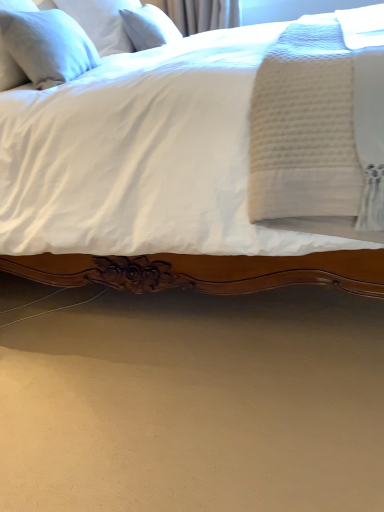
Question: Can you confirm if white linen pillow at upper left, placed as the first pillow when sorted from front to back, is positioned to the left of white soft pillow at upper left, which is the 2th pillow from back to front?

Choices:
 (A) yes
 (B) no

Answer: (A)

Question: Is white linen pillow at upper left, the third pillow viewed from the back, positioned with its back to white soft pillow at upper left, which is the 2th pillow from back to front?

Choices:
 (A) yes
 (B) no

Answer: (B)

Question: Could you tell me if white linen pillow at upper left, placed as the first pillow when sorted from front to back, is turned towards white soft pillow at upper left, marked as the second pillow in a front-to-back arrangement?

Choices:
 (A) yes
 (B) no

Answer: (B)

Question: Does white linen pillow at upper left, placed as the first pillow when sorted from front to back, have a greater width compared to white soft pillow at upper left, which is the 2th pillow from back to front?

Choices:
 (A) no
 (B) yes

Answer: (A)

Question: Is white linen pillow at upper left, placed as the first pillow when sorted from front to back, outside white soft pillow at upper left, marked as the second pillow in a front-to-back arrangement?

Choices:
 (A) yes
 (B) no

Answer: (A)

Question: Does white linen pillow at upper left, placed as the first pillow when sorted from front to back, have a lesser width compared to white soft pillow at upper left, marked as the second pillow in a front-to-back arrangement?

Choices:
 (A) no
 (B) yes

Answer: (B)

Question: Can you confirm if white soft pillow at upper left, marked as the second pillow in a front-to-back arrangement, is smaller than white soft pillow at upper left, which is counted as the third pillow, starting from the front?

Choices:
 (A) no
 (B) yes

Answer: (A)

Question: Is white soft pillow at upper left, which is the 2th pillow from back to front, bigger than white soft pillow at upper left, the 1th pillow when ordered from back to front?

Choices:
 (A) yes
 (B) no

Answer: (A)

Question: Is white soft pillow at upper left, which is the 2th pillow from back to front, at the right side of white soft pillow at upper left, which is counted as the third pillow, starting from the front?

Choices:
 (A) yes
 (B) no

Answer: (B)

Question: Is white soft pillow at upper left, marked as the second pillow in a front-to-back arrangement, positioned far away from white soft pillow at upper left, which is counted as the third pillow, starting from the front?

Choices:
 (A) yes
 (B) no

Answer: (B)

Question: Does white soft pillow at upper left, marked as the second pillow in a front-to-back arrangement, appear on the left side of white soft pillow at upper left, the 1th pillow when ordered from back to front?

Choices:
 (A) no
 (B) yes

Answer: (B)

Question: Are white soft pillow at upper left, which is the 2th pillow from back to front, and white soft pillow at upper left, the 1th pillow when ordered from back to front, beside each other?

Choices:
 (A) no
 (B) yes

Answer: (A)

Question: Is white soft pillow at upper left, which is counted as the third pillow, starting from the front, looking in the opposite direction of white linen pillow at upper left, the third pillow viewed from the back?

Choices:
 (A) yes
 (B) no

Answer: (B)